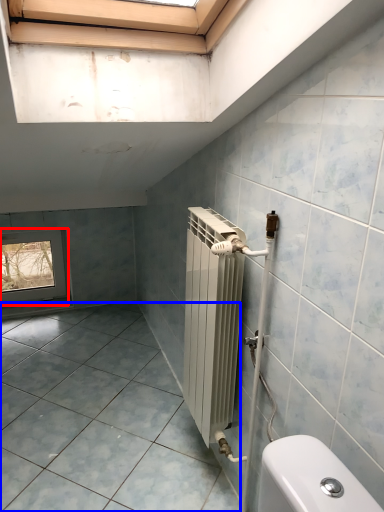
Question: Which of the following is the farthest to the observer, window (highlighted by a red box) or ceramic tile (highlighted by a blue box)?

Choices:
 (A) window
 (B) ceramic tile

Answer: (A)